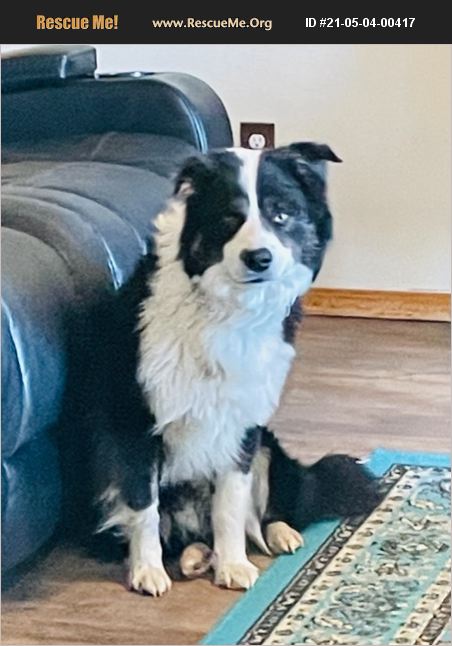
Find the location of a particular element. This screenshot has height=646, width=452. floor is located at coordinates (151, 620), (413, 379).